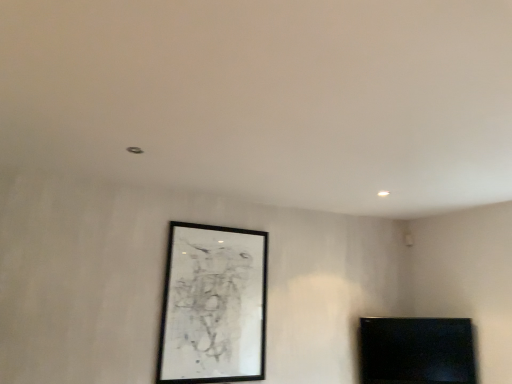
Question: Is black glossy tv at lower right bigger than black matte picture frame at center?

Choices:
 (A) no
 (B) yes

Answer: (A)

Question: Is black glossy tv at lower right wider than black matte picture frame at center?

Choices:
 (A) yes
 (B) no

Answer: (A)

Question: From a real-world perspective, is black glossy tv at lower right located beneath black matte picture frame at center?

Choices:
 (A) yes
 (B) no

Answer: (A)

Question: Considering the relative sizes of black glossy tv at lower right and black matte picture frame at center in the image provided, is black glossy tv at lower right shorter than black matte picture frame at center?

Choices:
 (A) no
 (B) yes

Answer: (B)

Question: Is the depth of black glossy tv at lower right less than that of black matte picture frame at center?

Choices:
 (A) yes
 (B) no

Answer: (B)

Question: From the image's perspective, is black glossy tv at lower right located beneath black matte picture frame at center?

Choices:
 (A) no
 (B) yes

Answer: (B)

Question: From a real-world perspective, is black matte picture frame at center over black glossy tv at lower right?

Choices:
 (A) yes
 (B) no

Answer: (A)

Question: Does black matte picture frame at center turn towards black glossy tv at lower right?

Choices:
 (A) no
 (B) yes

Answer: (A)

Question: Are black matte picture frame at center and black glossy tv at lower right far apart?

Choices:
 (A) yes
 (B) no

Answer: (A)

Question: Can you confirm if black matte picture frame at center is wider than black glossy tv at lower right?

Choices:
 (A) no
 (B) yes

Answer: (A)

Question: Is black matte picture frame at center completely or partially outside of black glossy tv at lower right?

Choices:
 (A) no
 (B) yes

Answer: (B)

Question: Is black matte picture frame at center shorter than black glossy tv at lower right?

Choices:
 (A) yes
 (B) no

Answer: (B)

Question: In terms of height, does black matte picture frame at center look taller or shorter compared to black glossy tv at lower right?

Choices:
 (A) short
 (B) tall

Answer: (B)